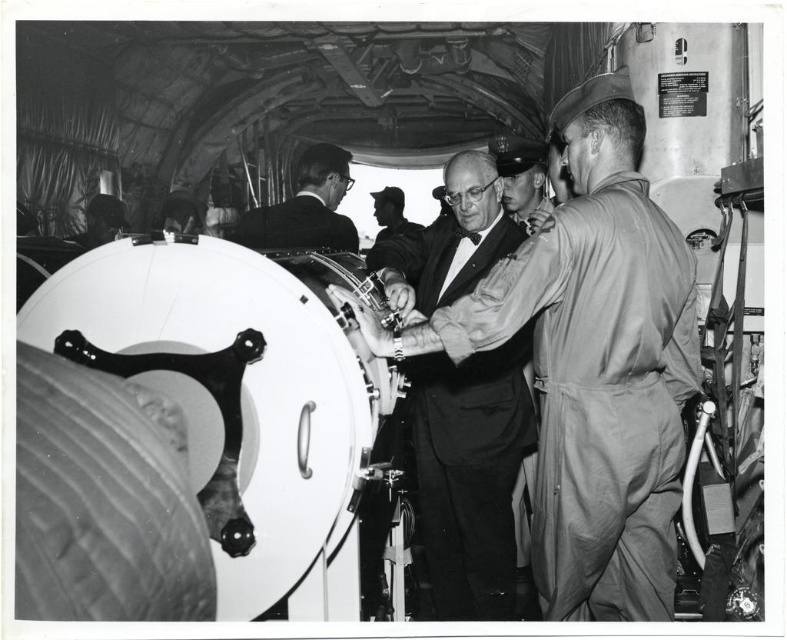
Question: Which point is farther to the camera?

Choices:
 (A) (626, 147)
 (B) (405, 224)
 (C) (525, 147)
 (D) (512, 476)

Answer: (B)

Question: Which of the following is the farthest from the observer?

Choices:
 (A) smooth fabric suit at center
 (B) smooth black suit at center
 (C) dark hair at upper left

Answer: (C)

Question: Is dark suit jacket at center further to the viewer compared to dark hair at upper left?

Choices:
 (A) no
 (B) yes

Answer: (A)

Question: Does smooth leather cap at center appear on the left side of dark blue uniform at center?

Choices:
 (A) no
 (B) yes

Answer: (A)

Question: Is dark hair at upper left closer to the viewer compared to dark blue uniform at center?

Choices:
 (A) no
 (B) yes

Answer: (B)

Question: Which point is closer to the camera?

Choices:
 (A) dark blue uniform at center
 (B) smooth leather cap at center
 (C) dark suit jacket at center

Answer: (B)